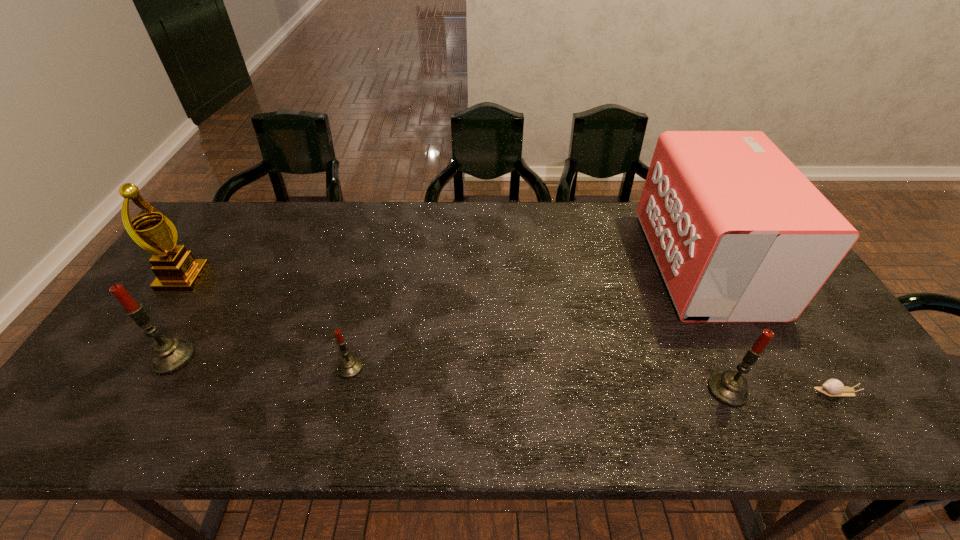
What are the coordinates of `vacant region that satisfies the following two spatial constraints: 1. on the front-facing side of the award; 2. on the back side of the rightmost candle` in the screenshot? It's located at (108, 390).

Identify the location of vacant region that satisfies the following two spatial constraints: 1. on the back side of the leftmost candle; 2. on the front-facing side of the award. (220, 278).